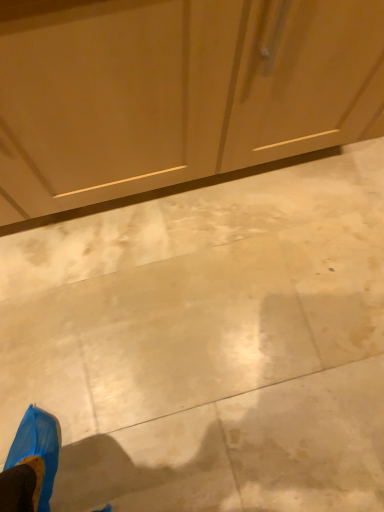
Question: Is beige polished concrete at center wider or thinner than matte wood dresser at upper center?

Choices:
 (A) wide
 (B) thin

Answer: (A)

Question: Visually, is beige polished concrete at center positioned to the left or to the right of matte wood dresser at upper center?

Choices:
 (A) right
 (B) left

Answer: (A)

Question: From a real-world perspective, is beige polished concrete at center physically located above or below matte wood dresser at upper center?

Choices:
 (A) below
 (B) above

Answer: (A)

Question: Is matte wood dresser at upper center in front of or behind beige polished concrete at center in the image?

Choices:
 (A) front
 (B) behind

Answer: (A)

Question: Is matte wood dresser at upper center situated inside beige polished concrete at center or outside?

Choices:
 (A) outside
 (B) inside

Answer: (A)

Question: In the image, is matte wood dresser at upper center on the left side or the right side of beige polished concrete at center?

Choices:
 (A) right
 (B) left

Answer: (B)

Question: From the image's perspective, is matte wood dresser at upper center located above or below beige polished concrete at center?

Choices:
 (A) below
 (B) above

Answer: (B)